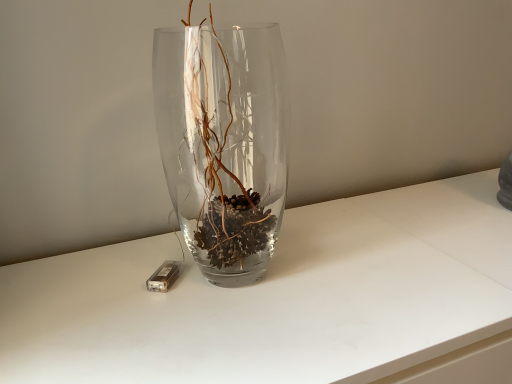
Question: From a real-world perspective, is transparent glass vase at center positioned above or below matte brown rectangular at left?

Choices:
 (A) above
 (B) below

Answer: (A)

Question: Choose the correct answer: Is transparent glass vase at center inside matte brown rectangular at left or outside it?

Choices:
 (A) inside
 (B) outside

Answer: (B)

Question: Does point (274, 170) appear closer or farther from the camera than point (167, 273)?

Choices:
 (A) farther
 (B) closer

Answer: (A)

Question: Is matte brown rectangular at left wider or thinner than transparent glass vase at center?

Choices:
 (A) wide
 (B) thin

Answer: (B)

Question: Is matte brown rectangular at left bigger or smaller than transparent glass vase at center?

Choices:
 (A) big
 (B) small

Answer: (B)

Question: From their relative heights in the image, would you say matte brown rectangular at left is taller or shorter than transparent glass vase at center?

Choices:
 (A) tall
 (B) short

Answer: (B)

Question: Would you say matte brown rectangular at left is to the left or to the right of transparent glass vase at center in the picture?

Choices:
 (A) left
 (B) right

Answer: (A)